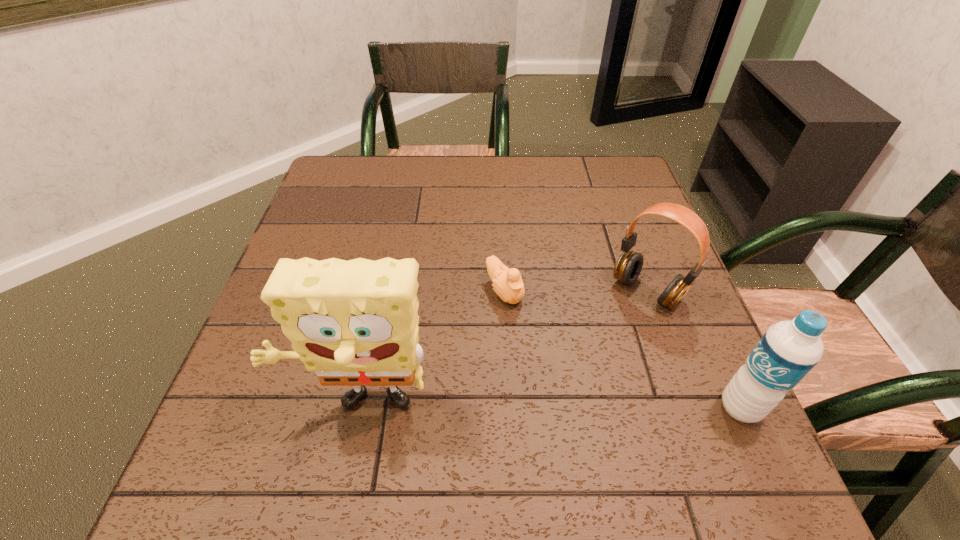
At what (x,y) coordinates should I click in order to perform the action: click on free space between the leftmost object and the headset. Please return your answer as a coordinate pair (x, y). Image resolution: width=960 pixels, height=540 pixels. Looking at the image, I should click on (504, 349).

Find the location of a particular element. empty space between the duckling and the water bottle is located at coordinates (622, 349).

In order to click on free space between the duckling and the headset in this screenshot , I will do 575,291.

Locate an element on the screen. unoccupied position between the shortest object and the tallest object is located at coordinates (432, 348).

This screenshot has height=540, width=960. I want to click on free space between the water bottle and the sponge, so click(x=550, y=407).

Identify the location of empty space that is in between the shortest object and the water bottle. (622, 349).

Locate an element on the screen. empty space that is in between the headset and the water bottle is located at coordinates (693, 349).

At what (x,y) coordinates should I click in order to perform the action: click on free area in between the headset and the water bottle. Please return your answer as a coordinate pair (x, y). The width and height of the screenshot is (960, 540). Looking at the image, I should click on (693, 349).

I want to click on free space that is in between the duckling and the tallest object, so click(x=432, y=348).

Select which object is the closest to the duckling. Please provide its 2D coordinates. Your answer should be formatted as a tuple, i.e. [(x, y)], where the tuple contains the x and y coordinates of a point satisfying the conditions above.

[(355, 323)]